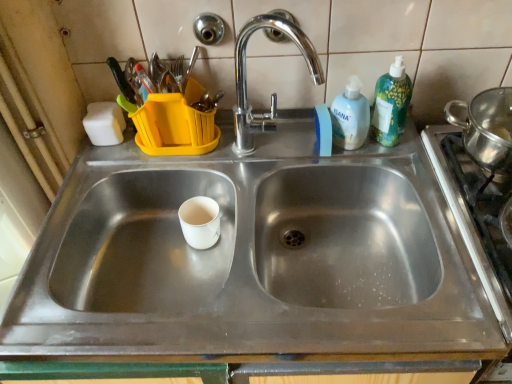
The image size is (512, 384). What do you see at coordinates (200, 221) in the screenshot?
I see `white matte paper cup at center` at bounding box center [200, 221].

Locate an element on the screen. This screenshot has width=512, height=384. white matte paper cup at center is located at coordinates (200, 221).

I want to click on white matte sponge at upper left, so click(x=104, y=123).

From the picture: In order to face green plastic bottle at upper right, arranged as the 1th cleaning product when viewed from the right, should I rotate leftwards or rightwards?

A 17.486 degree turn to the right will do.

What is the approximate height of polished chrome faucet at upper center?

polished chrome faucet at upper center is 13.22 inches tall.

Identify the location of white matte paper cup at center. Image resolution: width=512 pixels, height=384 pixels. (200, 221).

In the scene shown: How different are the orientations of polished chrome faucet at upper center and white plastic bottle at upper right, marked as the 2th cleaning product in a right-to-left arrangement, in degrees?

0.272 degrees separate the facing orientations of polished chrome faucet at upper center and white plastic bottle at upper right, marked as the 2th cleaning product in a right-to-left arrangement.

Is polished chrome faucet at upper center thinner than white plastic bottle at upper right, marked as the 2th cleaning product in a right-to-left arrangement?

In fact, polished chrome faucet at upper center might be wider than white plastic bottle at upper right, marked as the 2th cleaning product in a right-to-left arrangement.

Consider the image. Can you confirm if polished chrome faucet at upper center is bigger than white plastic bottle at upper right, the 1th cleaning product when ordered from left to right?

Correct, polished chrome faucet at upper center is larger in size than white plastic bottle at upper right, the 1th cleaning product when ordered from left to right.

Considering the sizes of objects green plastic bottle at upper right, arranged as the 1th cleaning product when viewed from the right, and white matte paper cup at center in the image provided, who is shorter, green plastic bottle at upper right, arranged as the 1th cleaning product when viewed from the right, or white matte paper cup at center?

Standing shorter between the two is white matte paper cup at center.

Is green plastic bottle at upper right, arranged as the 1th cleaning product when viewed from the right, touching white matte paper cup at center?

green plastic bottle at upper right, arranged as the 1th cleaning product when viewed from the right, and white matte paper cup at center are not in contact.

Is green plastic bottle at upper right, arranged as the 1th cleaning product when viewed from the right, positioned before white matte paper cup at center?

Yes, green plastic bottle at upper right, arranged as the 1th cleaning product when viewed from the right, is closer to the viewer.

Could you tell me if green plastic bottle at upper right, arranged as the 1th cleaning product when viewed from the right, is turned towards white matte paper cup at center?

No.

Based on the photo, is stainless steel gas stove at right bigger than white matte sponge at upper left?

Indeed, stainless steel gas stove at right has a larger size compared to white matte sponge at upper left.

The width and height of the screenshot is (512, 384). Find the location of `gas stove on the right of white matte sponge at upper left`. gas stove on the right of white matte sponge at upper left is located at coordinates (480, 205).

Could you tell me if stainless steel gas stove at right is facing white matte sponge at upper left?

No.

From a real-world perspective, is white plastic bottle at upper right, marked as the 2th cleaning product in a right-to-left arrangement, physically located above or below polished chrome faucet at upper center?

From a real-world perspective, white plastic bottle at upper right, marked as the 2th cleaning product in a right-to-left arrangement, is physically below polished chrome faucet at upper center.

Would you say white plastic bottle at upper right, marked as the 2th cleaning product in a right-to-left arrangement, is to the left or to the right of polished chrome faucet at upper center in the picture?

From the image, it's evident that white plastic bottle at upper right, marked as the 2th cleaning product in a right-to-left arrangement, is to the right of polished chrome faucet at upper center.

Is there a large distance between white plastic bottle at upper right, marked as the 2th cleaning product in a right-to-left arrangement, and polished chrome faucet at upper center?

Actually, white plastic bottle at upper right, marked as the 2th cleaning product in a right-to-left arrangement, and polished chrome faucet at upper center are a little close together.

Considering the positions of objects white plastic bottle at upper right, the 1th cleaning product when ordered from left to right, and stainless steel gas stove at right in the image provided, who is more to the right, white plastic bottle at upper right, the 1th cleaning product when ordered from left to right, or stainless steel gas stove at right?

stainless steel gas stove at right is more to the right.

Considering the sizes of objects white plastic bottle at upper right, marked as the 2th cleaning product in a right-to-left arrangement, and stainless steel gas stove at right in the image provided, who is shorter, white plastic bottle at upper right, marked as the 2th cleaning product in a right-to-left arrangement, or stainless steel gas stove at right?

white plastic bottle at upper right, marked as the 2th cleaning product in a right-to-left arrangement, is shorter.

Between white plastic bottle at upper right, marked as the 2th cleaning product in a right-to-left arrangement, and stainless steel gas stove at right, which one is positioned in front?

stainless steel gas stove at right is more forward.

Can you confirm if white matte paper cup at center is taller than white matte sponge at upper left?

In fact, white matte paper cup at center may be shorter than white matte sponge at upper left.

Is white matte paper cup at center not inside white matte sponge at upper left?

Yes, white matte paper cup at center is outside of white matte sponge at upper left.

Is white matte paper cup at center turned away from white matte sponge at upper left?

white matte paper cup at center is not turned away from white matte sponge at upper left.

Considering the relative positions of green plastic bottle at upper right, positioned as the second cleaning product in left-to-right order, and stainless steel gas stove at right in the image provided, is green plastic bottle at upper right, positioned as the second cleaning product in left-to-right order, to the left of stainless steel gas stove at right from the viewer's perspective?

Yes, green plastic bottle at upper right, positioned as the second cleaning product in left-to-right order, is to the left of stainless steel gas stove at right.

Can you confirm if green plastic bottle at upper right, arranged as the 1th cleaning product when viewed from the right, is taller than stainless steel gas stove at right?

Indeed, green plastic bottle at upper right, arranged as the 1th cleaning product when viewed from the right, has a greater height compared to stainless steel gas stove at right.

Who is more distant, green plastic bottle at upper right, arranged as the 1th cleaning product when viewed from the right, or stainless steel gas stove at right?

green plastic bottle at upper right, arranged as the 1th cleaning product when viewed from the right, is further away from the camera.

The image size is (512, 384). I want to click on cleaning product located below the polished chrome faucet at upper center (from the image's perspective), so click(350, 116).

From a real-world perspective, which cleaning product is the 2nd one above the white matte paper cup at center? Please provide its 2D coordinates.

[(391, 104)]

Looking at the image, which one is located further to white matte paper cup at center, white plastic bottle at upper right, marked as the 2th cleaning product in a right-to-left arrangement, or green plastic bottle at upper right, positioned as the second cleaning product in left-to-right order?

green plastic bottle at upper right, positioned as the second cleaning product in left-to-right order, is further to white matte paper cup at center.

Looking at the image, which one is located further to white matte paper cup at center, white matte sponge at upper left or green plastic bottle at upper right, positioned as the second cleaning product in left-to-right order?

A: Among the two, green plastic bottle at upper right, positioned as the second cleaning product in left-to-right order, is located further to white matte paper cup at center.

Which object lies further to the anchor point green plastic bottle at upper right, arranged as the 1th cleaning product when viewed from the right, white matte sponge at upper left or polished chrome faucet at upper center?

white matte sponge at upper left is further to green plastic bottle at upper right, arranged as the 1th cleaning product when viewed from the right.

Which object lies further to the anchor point white matte sponge at upper left, green plastic bottle at upper right, arranged as the 1th cleaning product when viewed from the right, or polished chrome faucet at upper center?

green plastic bottle at upper right, arranged as the 1th cleaning product when viewed from the right, lies further to white matte sponge at upper left than the other object.

When comparing their distances from polished chrome faucet at upper center, does white matte sponge at upper left or stainless steel gas stove at right seem further?

The object further to polished chrome faucet at upper center is stainless steel gas stove at right.

When comparing their distances from white matte sponge at upper left, does polished chrome faucet at upper center or green plastic bottle at upper right, arranged as the 1th cleaning product when viewed from the right, seem closer?

Among the two, polished chrome faucet at upper center is located nearer to white matte sponge at upper left.

Looking at the image, which one is located further to white matte sponge at upper left, stainless steel gas stove at right or polished chrome faucet at upper center?

Among the two, stainless steel gas stove at right is located further to white matte sponge at upper left.

Estimate the real-world distances between objects in this image. Which object is closer to stainless steel gas stove at right, white matte sponge at upper left or white plastic bottle at upper right, the 1th cleaning product when ordered from left to right?

white plastic bottle at upper right, the 1th cleaning product when ordered from left to right, is positioned closer to the anchor stainless steel gas stove at right.

The height and width of the screenshot is (384, 512). I want to click on tap between white matte paper cup at center and stainless steel gas stove at right in the horizontal direction, so click(273, 93).

Where is `paper cup situated between white matte sponge at upper left and white plastic bottle at upper right, marked as the 2th cleaning product in a right-to-left arrangement, from left to right`? The image size is (512, 384). paper cup situated between white matte sponge at upper left and white plastic bottle at upper right, marked as the 2th cleaning product in a right-to-left arrangement, from left to right is located at coordinates (200, 221).

Where is `cleaning product between white matte paper cup at center and green plastic bottle at upper right, arranged as the 1th cleaning product when viewed from the right, from left to right`? cleaning product between white matte paper cup at center and green plastic bottle at upper right, arranged as the 1th cleaning product when viewed from the right, from left to right is located at coordinates (350, 116).

Locate an element on the screen. paper cup between white matte sponge at upper left and stainless steel gas stove at right from left to right is located at coordinates (200, 221).